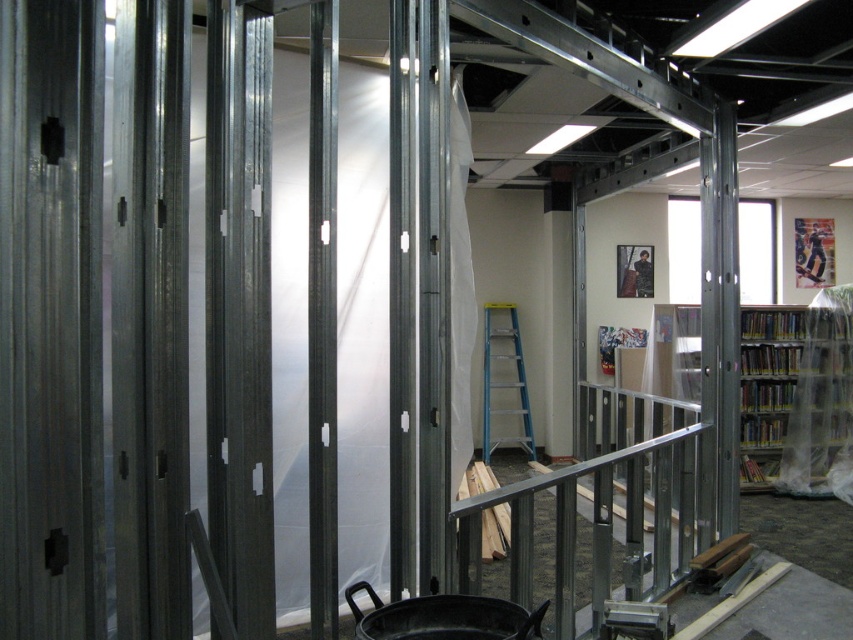
Question: Among these objects, which one is farthest from the camera?

Choices:
 (A) metallic silver rail at center
 (B) blue aluminum ladder at center

Answer: (B)

Question: Considering the real-world distances, which object is farthest from the clear plastic bookshelf at right?

Choices:
 (A) blue aluminum ladder at center
 (B) metallic silver rail at center

Answer: (A)

Question: From the image, what is the correct spatial relationship of clear plastic bookshelf at right in relation to blue aluminum ladder at center?

Choices:
 (A) above
 (B) below

Answer: (B)

Question: Which object is the closest to the clear plastic bookshelf at right?

Choices:
 (A) metallic silver rail at center
 (B) blue aluminum ladder at center

Answer: (A)

Question: Considering the relative positions of metallic silver rail at center and clear plastic bookshelf at right in the image provided, where is metallic silver rail at center located with respect to clear plastic bookshelf at right?

Choices:
 (A) above
 (B) below

Answer: (B)

Question: Is clear plastic bookshelf at right above blue aluminum ladder at center?

Choices:
 (A) no
 (B) yes

Answer: (A)